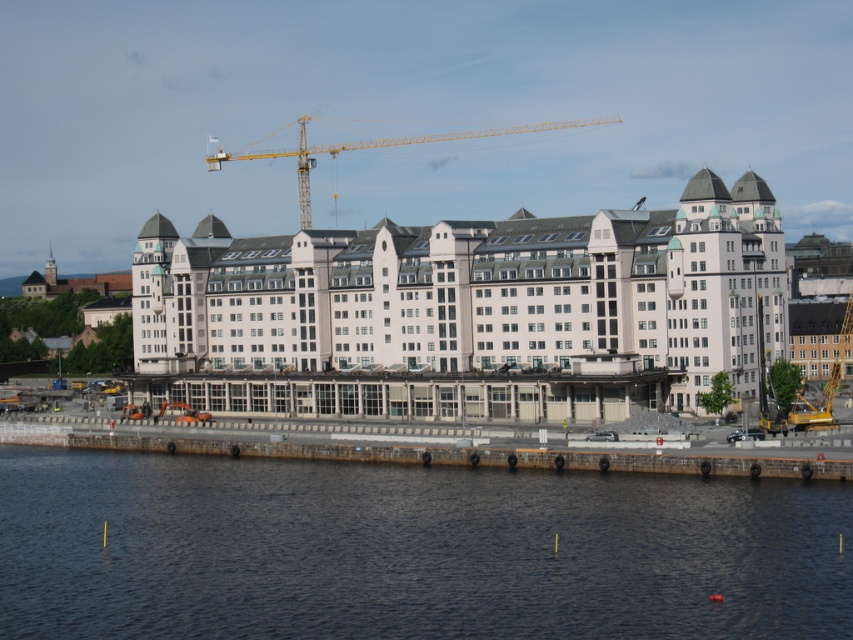
Question: Is dark blue water at lower center positioned in front of yellow metallic crane at center?

Choices:
 (A) no
 (B) yes

Answer: (B)

Question: Does dark blue water at lower center appear on the right side of white smooth building at center?

Choices:
 (A) yes
 (B) no

Answer: (B)

Question: Among these objects, which one is farthest from the camera?

Choices:
 (A) yellow metallic crane at center
 (B) dark blue water at lower center
 (C) white smooth building at center

Answer: (A)

Question: Which is nearer to the white smooth building at center?

Choices:
 (A) dark blue water at lower center
 (B) yellow metallic crane at center

Answer: (A)

Question: Does dark blue water at lower center appear on the right side of yellow metallic crane at center?

Choices:
 (A) yes
 (B) no

Answer: (B)

Question: Which point is closer to the camera?

Choices:
 (A) white smooth building at center
 (B) dark blue water at lower center
 (C) yellow metallic crane at center

Answer: (B)